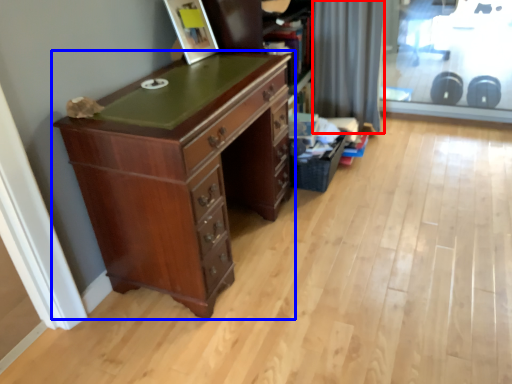
Question: Which point is further to the camera, curtain (highlighted by a red box) or chest of drawers (highlighted by a blue box)?

Choices:
 (A) curtain
 (B) chest of drawers

Answer: (A)